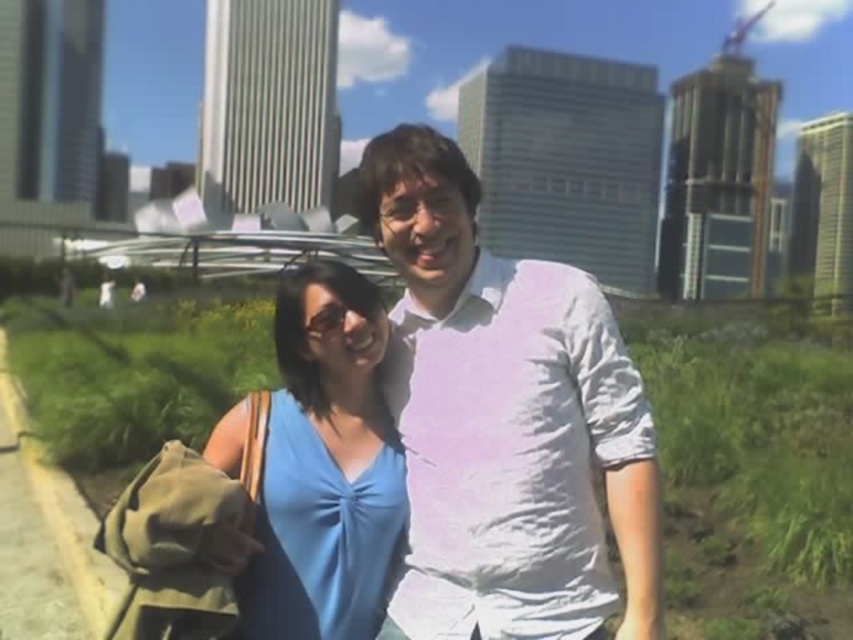
Can you confirm if white cotton shirt at center is shorter than blue fabric dress at center?

No, white cotton shirt at center is not shorter than blue fabric dress at center.

Between point (548, 340) and point (320, 586), which one is positioned behind?

The point (320, 586) is more distant.

The image size is (853, 640). Find the location of `white cotton shirt at center`. white cotton shirt at center is located at coordinates (503, 420).